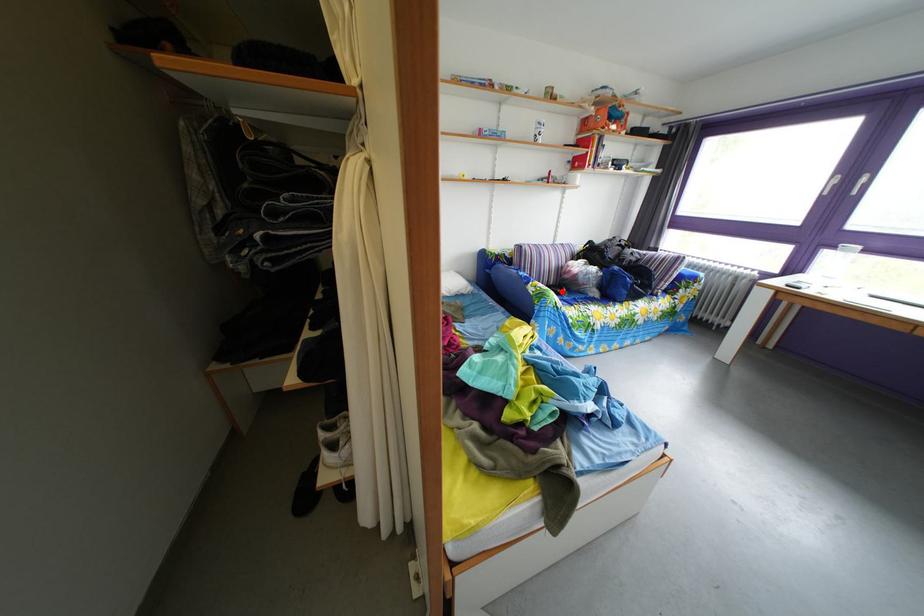
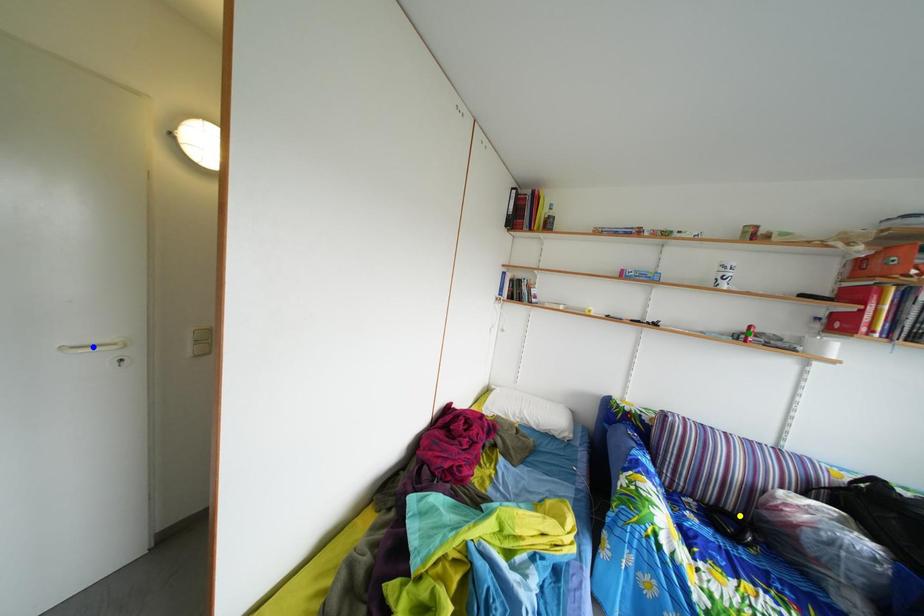
Question: I am providing you with two images of the same scene from different viewpoints. A red point is marked on the first image. You are given multiple points on the second image. In image 2, which mark is for the same physical point as the one in image 1?

Choices:
 (A) blue point
 (B) yellow point
 (C) green point

Answer: (B)